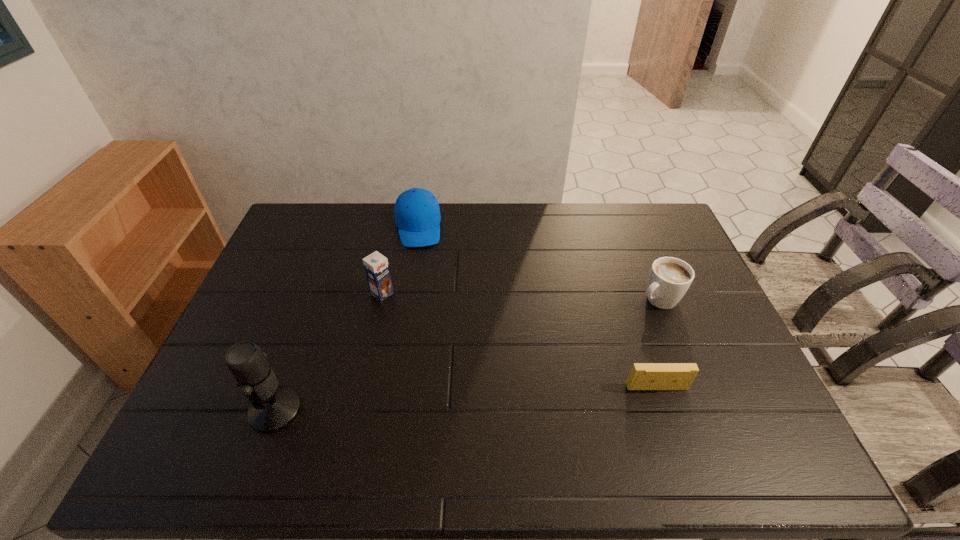
At what (x,y) coordinates should I click in order to perform the action: click on object that is at the left edge. Please return your answer as a coordinate pair (x, y). This screenshot has width=960, height=540. Looking at the image, I should click on (273, 407).

Identify the location of object that is positioned at the right edge. This screenshot has width=960, height=540. (669, 279).

The height and width of the screenshot is (540, 960). Find the location of `object present at the near left corner`. object present at the near left corner is located at coordinates (273, 407).

Locate an element on the screen. The image size is (960, 540). free region at the far edge of the desktop is located at coordinates (342, 206).

In the image, there is a desktop. At what (x,y) coordinates should I click in order to perform the action: click on free region at the near edge. Please return your answer as a coordinate pair (x, y). The image size is (960, 540). Looking at the image, I should click on (490, 400).

Where is `vacant space at the left edge`? vacant space at the left edge is located at coordinates (264, 320).

You are a GUI agent. You are given a task and a screenshot of the screen. Output one action in this format:
    pyautogui.click(x=<x>, y=<y>)
    Task: Click on the free region at the far left corner of the desktop
    
    Given the screenshot: What is the action you would take?
    pyautogui.click(x=311, y=230)

At what (x,y) coordinates should I click in order to perform the action: click on vacant area at the far right corner. Please return your answer as a coordinate pair (x, y). This screenshot has width=960, height=540. Looking at the image, I should click on (628, 219).

I want to click on vacant space that is in between the farthest object and the fourth shortest object, so 400,260.

I want to click on vacant space that's between the chocolate milk and the microphone, so pos(329,352).